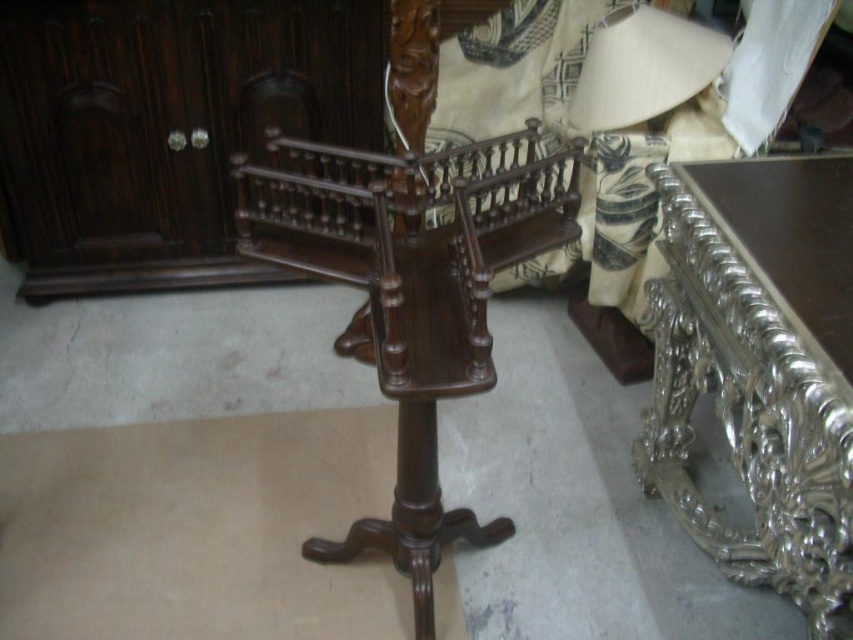
Does polished dark wood coat rack at center appear on the left side of matte beige paper lampshade at upper right?

Correct, you'll find polished dark wood coat rack at center to the left of matte beige paper lampshade at upper right.

You are a GUI agent. You are given a task and a screenshot of the screen. Output one action in this format:
    pyautogui.click(x=<x>, y=<y>)
    Task: Click on the polished dark wood coat rack at center
    
    Given the screenshot: What is the action you would take?
    pyautogui.click(x=410, y=292)

The image size is (853, 640). Find the location of `polished dark wood coat rack at center`. polished dark wood coat rack at center is located at coordinates (410, 292).

Locate an element on the screen. This screenshot has height=640, width=853. polished dark wood coat rack at center is located at coordinates pos(410,292).

Does silver metallic table at right appear under polished dark wood coat rack at center?

Indeed, silver metallic table at right is positioned under polished dark wood coat rack at center.

Who is shorter, silver metallic table at right or polished dark wood coat rack at center?

With less height is silver metallic table at right.

Which is in front, point (671, 253) or point (407, 524)?

Point (407, 524) is in front.

Identify the location of silver metallic table at right. (759, 368).

Does silver metallic table at right appear over matte beige paper lampshade at upper right?

No.

Measure the distance from silver metallic table at right to matte beige paper lampshade at upper right.

silver metallic table at right and matte beige paper lampshade at upper right are 20.63 inches apart.

This screenshot has width=853, height=640. What do you see at coordinates (759, 368) in the screenshot? I see `silver metallic table at right` at bounding box center [759, 368].

Locate an element on the screen. silver metallic table at right is located at coordinates (759, 368).